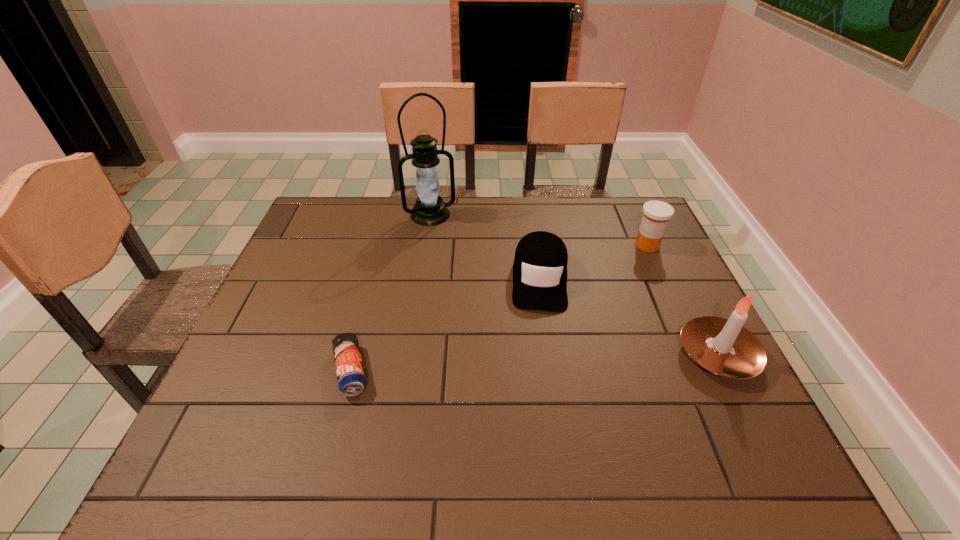
Where is `free location located 0.050m on the front-facing side of the second shortest object`? Image resolution: width=960 pixels, height=540 pixels. free location located 0.050m on the front-facing side of the second shortest object is located at coordinates (541, 328).

Find the location of a particular element. The image size is (960, 540). vacant area situated on the front-facing side of the second shortest object is located at coordinates pos(540,335).

You are a GUI agent. You are given a task and a screenshot of the screen. Output one action in this format:
    pyautogui.click(x=<x>, y=<y>)
    Task: Click on the free location located on the label of the medicine
    The image size is (960, 540).
    Given the screenshot: What is the action you would take?
    click(x=587, y=312)

Locate an element on the screen. The width and height of the screenshot is (960, 540). blank space located on the label of the medicine is located at coordinates (581, 319).

Find the location of a particular element. Image resolution: width=960 pixels, height=540 pixels. vacant space located 0.310m on the label of the medicine is located at coordinates (588, 310).

I want to click on vacant area located 0.300m on the side where the lantern emits light, so click(x=465, y=287).

Identify the location of vacant space located on the side where the lantern emits light. Image resolution: width=960 pixels, height=540 pixels. (450, 253).

Identify the location of vacant space located 0.260m on the side where the lantern emits light. (461, 277).

I want to click on medicine that is at the far edge, so click(656, 214).

Image resolution: width=960 pixels, height=540 pixels. Find the location of `lantern present at the far edge`. lantern present at the far edge is located at coordinates (430, 209).